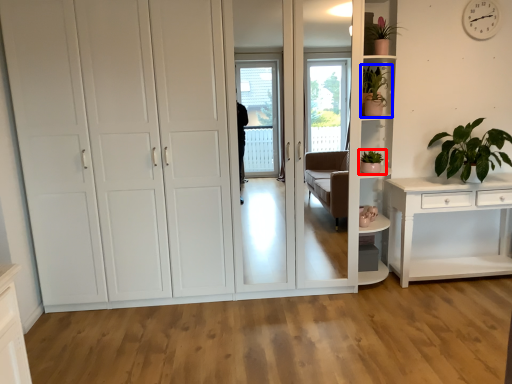
Question: Which of the following is the farthest to the observer, houseplant (highlighted by a red box) or houseplant (highlighted by a blue box)?

Choices:
 (A) houseplant
 (B) houseplant

Answer: (A)